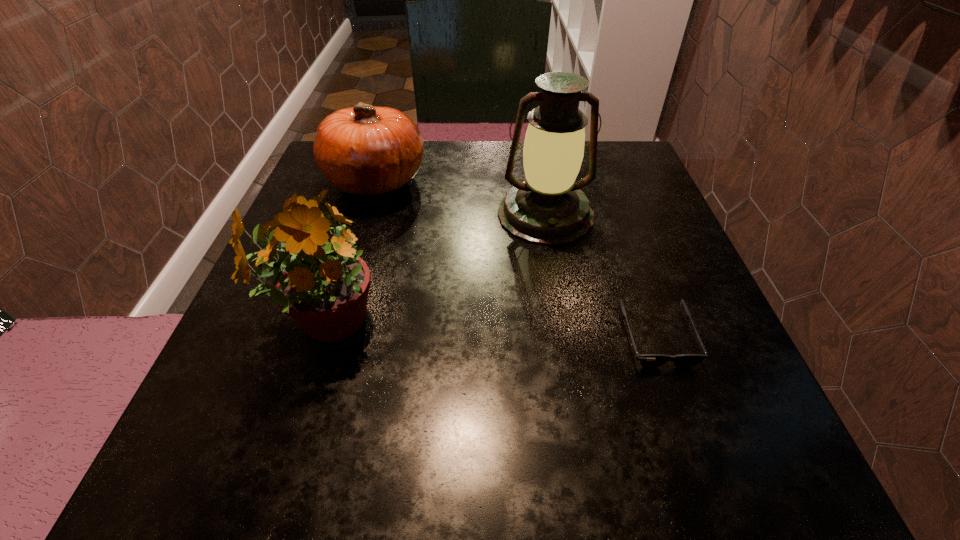
Locate an element on the screen. the third closest object to the flowerpot is located at coordinates (646, 360).

Locate an element on the screen. free spot that satisfies the following two spatial constraints: 1. on the back side of the pumpkin; 2. on the right side of the flowerpot is located at coordinates (370, 181).

You are a GUI agent. You are given a task and a screenshot of the screen. Output one action in this format:
    pyautogui.click(x=<x>, y=<y>)
    Task: Click on the vacant space that satisfies the following two spatial constraints: 1. on the back side of the flowerpot; 2. on the right side of the third tallest object
    The width and height of the screenshot is (960, 540).
    Given the screenshot: What is the action you would take?
    pyautogui.click(x=370, y=181)